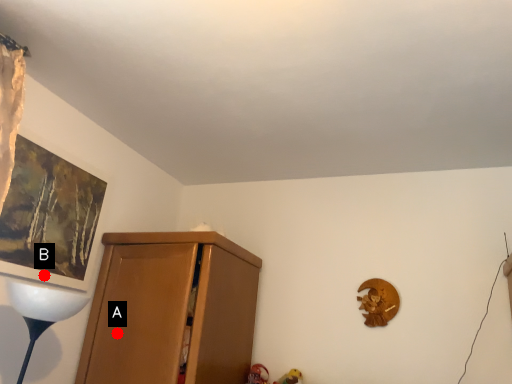
Question: Two points are circled on the image, labeled by A and B beside each circle. Which point is closer to the camera taking this photo?

Choices:
 (A) A is closer
 (B) B is closer

Answer: (B)